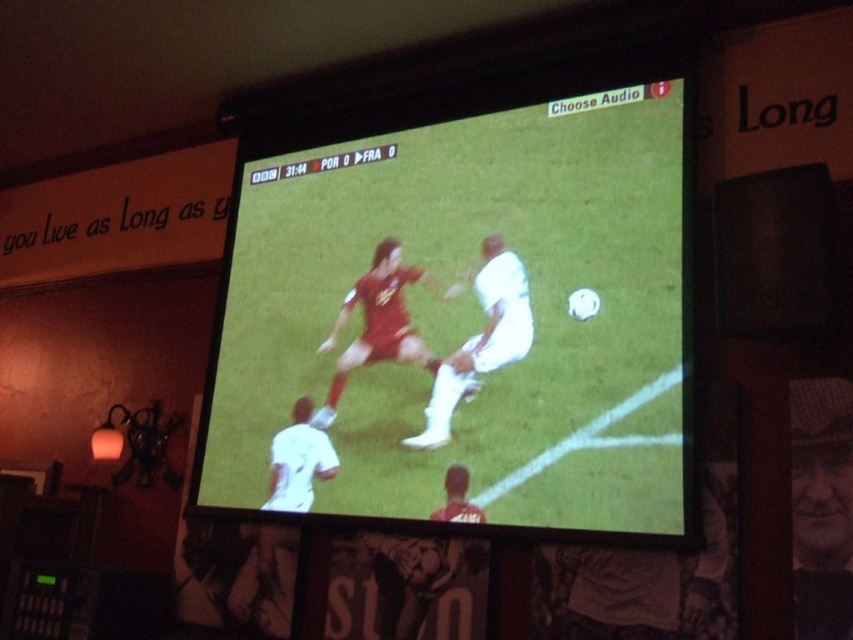
Question: Is matte white soccer ball at center closer to the viewer compared to white matte soccer player at center?

Choices:
 (A) no
 (B) yes

Answer: (B)

Question: Among these objects, which one is nearest to the camera?

Choices:
 (A) white matte soccer player at center
 (B) matte white soccer ball at center
 (C) white matte jersey at lower left
 (D) smooth leather hat at upper right

Answer: (D)

Question: Which point is farther from the camera taking this photo?

Choices:
 (A) (474, 340)
 (B) (838, 420)
 (C) (393, 259)

Answer: (C)

Question: Is matte white soccer ball at center positioned at the back of matte red jersey at center?

Choices:
 (A) yes
 (B) no

Answer: (B)

Question: Is matte white soccer ball at center behind white matte soccer player at center?

Choices:
 (A) yes
 (B) no

Answer: (B)

Question: Considering the real-world distances, which object is farthest from the matte red jersey at center?

Choices:
 (A) matte white soccer ball at center
 (B) white matte soccer player at center
 (C) white matte jersey at lower left
 (D) smooth leather hat at upper right

Answer: (D)